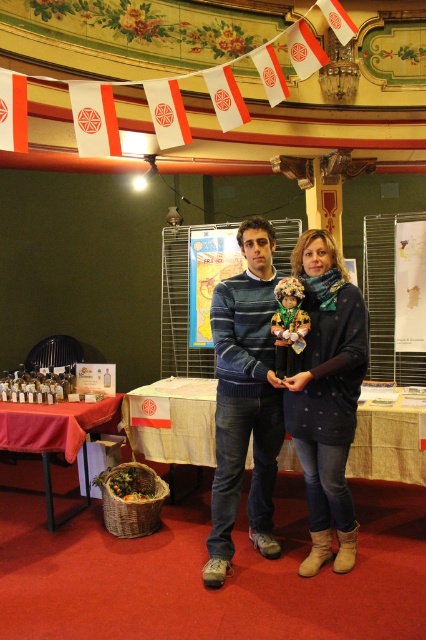
Question: Is wooden table at center below red fabric table at lower left?

Choices:
 (A) no
 (B) yes

Answer: (A)

Question: Which point appears farthest from the camera in this image?

Choices:
 (A) (313, 228)
 (B) (2, 435)
 (C) (411, 438)

Answer: (A)

Question: Does knit sweater at center have a smaller size compared to red fabric table at lower left?

Choices:
 (A) no
 (B) yes

Answer: (B)

Question: Which object is the closest to the knit sweater at center?

Choices:
 (A) red fabric table at lower left
 (B) wooden table at center

Answer: (B)

Question: From the image, what is the correct spatial relationship of knit sweater at center in relation to red fabric table at lower left?

Choices:
 (A) right
 (B) left

Answer: (A)

Question: Which point is farther to the camera?

Choices:
 (A) (368, 440)
 (B) (342, 337)

Answer: (A)